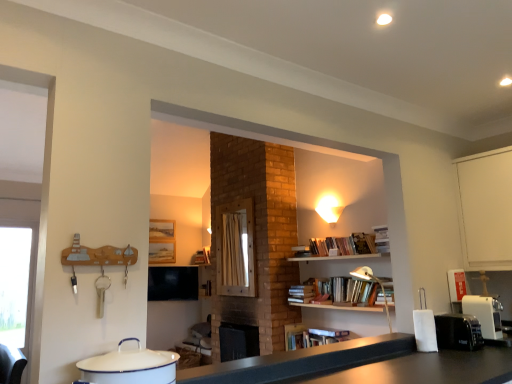
Question: Visually, is metallic silver lamp at upper right positioned to the left or to the right of wooden frame at center?

Choices:
 (A) right
 (B) left

Answer: (A)

Question: Considering the positions of metallic silver lamp at upper right and wooden frame at center in the image, is metallic silver lamp at upper right wider or thinner than wooden frame at center?

Choices:
 (A) thin
 (B) wide

Answer: (B)

Question: Considering the real-world distances, which object is farthest from the matte white lampshade at upper center?

Choices:
 (A) black plastic toaster at right, which appears as the first appliance when viewed from the right
 (B) hardcover book at upper right
 (C) wooden frame at center
 (D) metallic silver lamp at upper right
 (E) white enamel pot at lower left, the 2th appliance positioned from the right

Answer: (E)

Question: Which is nearer to the matte white lampshade at upper center?

Choices:
 (A) black matte counter top at center
 (B) white enamel pot at lower left, the 2th appliance positioned from the bottom
 (C) wooden frame at center
 (D) hardcover book at upper right
 (E) black plastic toaster at right, the 2th appliance viewed from the top

Answer: (D)